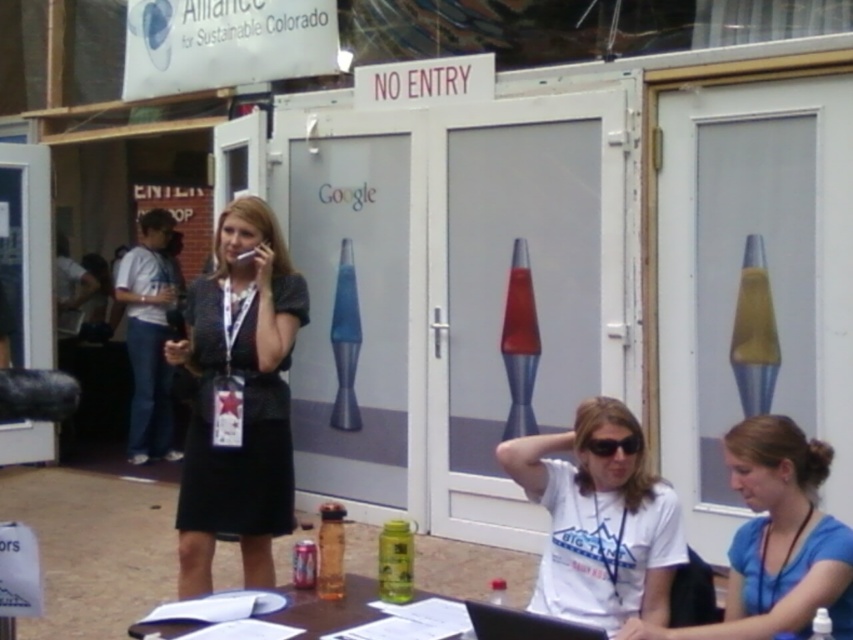
Between point (608, 483) and point (515, 625), which one is positioned in front?

Positioned in front is point (515, 625).

Who is more distant from viewer, (599, 490) or (495, 637)?

The point (599, 490) is more distant.

At what (x,y) coordinates should I click in order to perform the action: click on white matte shirt at center. Please return your answer as a coordinate pair (x, y). This screenshot has width=853, height=640. Looking at the image, I should click on (599, 522).

The width and height of the screenshot is (853, 640). I want to click on white matte shirt at center, so click(599, 522).

Image resolution: width=853 pixels, height=640 pixels. What do you see at coordinates (524, 625) in the screenshot?
I see `black plastic laptop at lower center` at bounding box center [524, 625].

Which is more to the left, black plastic laptop at lower center or black plastic sunglasses at center?

black plastic laptop at lower center

The image size is (853, 640). In order to click on black plastic laptop at lower center in this screenshot , I will do `click(524, 625)`.

Which of these two, black fabric dress at center or white matte shirt at lower center, stands shorter?

Standing shorter between the two is white matte shirt at lower center.

Is point (247, 292) positioned behind point (820, 604)?

Yes.

Find the location of a particular element. The image size is (853, 640). black fabric dress at center is located at coordinates (239, 397).

You are a GUI agent. You are given a task and a screenshot of the screen. Output one action in this format:
    pyautogui.click(x=<x>, y=<y>)
    Task: Click on the black fabric dress at center
    
    Given the screenshot: What is the action you would take?
    pyautogui.click(x=239, y=397)